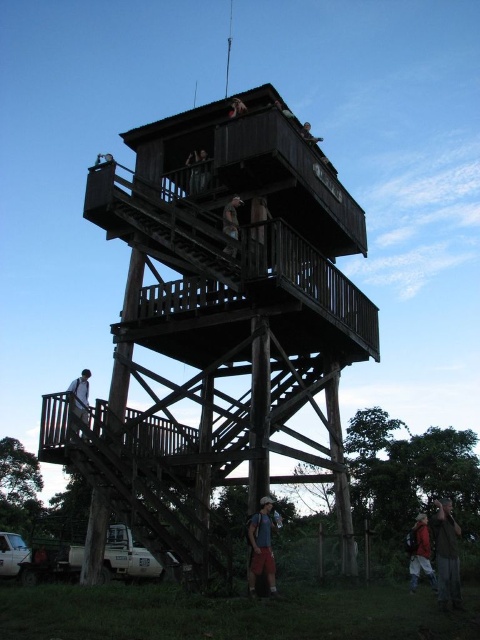
You are standing at the point labeled as point (x=271, y=592) and want to take a photo of the camera. Given that the camera is 136.60 feet away from you, can you estimate if you are within the recommended 150 feet range for optimal photo clarity?

Yes, since the distance between you and the camera is 136.60 feet, which is within the recommended 150 feet range for optimal photo clarity.

You are standing at the base of the wooden observation tower and notice a blue fabric backpack at lower center and a wooden helmet at upper center. Which object is closer to the ground?

The blue fabric backpack at lower center is closer to the ground because it is positioned under the wooden helmet at upper center.

You are standing at the base of the wooden observation tower and want to reach the top level. There are two points marked on your map labeled as point (x=435, y=518) and point (x=264, y=524). Which point should you aim for first if you want to ascend to the highest level?

You should aim for point (x=264, y=524) first because point (x=435, y=518) is behind it, meaning point (x=264, y=524) is closer to the starting position at the base and thus part of the ascending path.